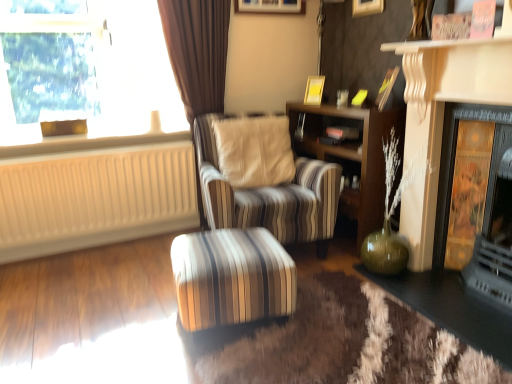
The height and width of the screenshot is (384, 512). Find the location of `vacant area that lies between striped fabric ottoman at center, which is the 1th table in left-to-right order, and green glass vase at lower right, which ranks as the first table in right-to-left order`. vacant area that lies between striped fabric ottoman at center, which is the 1th table in left-to-right order, and green glass vase at lower right, which ranks as the first table in right-to-left order is located at coordinates (356, 324).